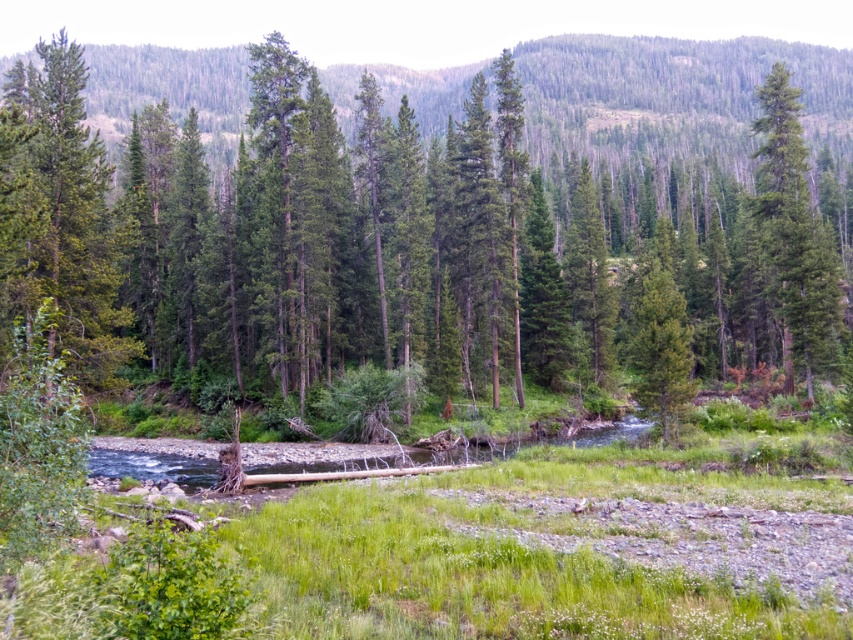
Question: Does green matte tree at center have a smaller size compared to green matte tree at right?

Choices:
 (A) yes
 (B) no

Answer: (B)

Question: Observing the image, what is the correct spatial positioning of green matte tree at center in reference to green matte tree at left?

Choices:
 (A) right
 (B) left

Answer: (B)

Question: Which of the following is the farthest from the observer?

Choices:
 (A) (77, 164)
 (B) (815, 289)

Answer: (B)

Question: Can you confirm if green matte tree at left is positioned to the right of green matte tree at right?

Choices:
 (A) no
 (B) yes

Answer: (A)

Question: Based on their relative distances, which object is farther from the green matte tree at right?

Choices:
 (A) green matte tree at center
 (B) green matte tree at left

Answer: (A)

Question: Which of these objects is positioned closest to the green matte tree at left?

Choices:
 (A) green matte tree at right
 (B) green matte tree at center

Answer: (A)